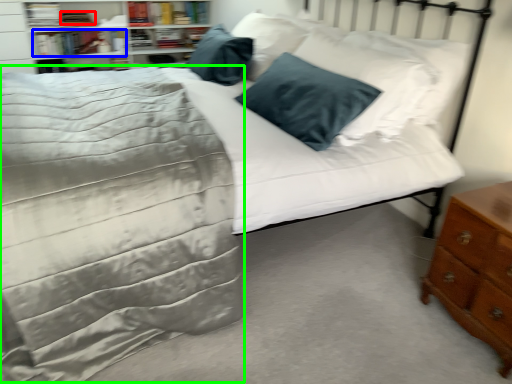
Question: Which object is positioned farthest from book (highlighted by a red box)? Select from book (highlighted by a blue box) and bedding (highlighted by a green box).

Choices:
 (A) book
 (B) bedding

Answer: (B)